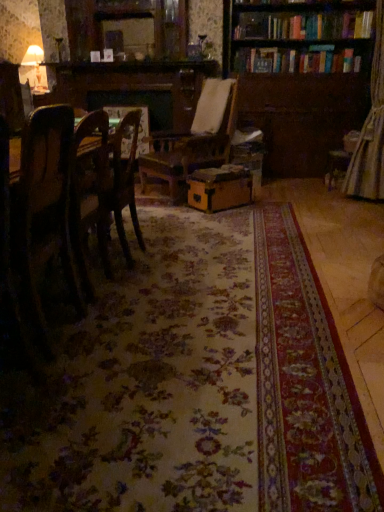
Where is `matte brown cardboard box at center`? matte brown cardboard box at center is located at coordinates (220, 188).

Where is `wooden bookcase at upper right`? wooden bookcase at upper right is located at coordinates (298, 93).

From the picture: Considering their positions, is wooden bookcase at upper right located in front of or behind matte brown cardboard box at center?

wooden bookcase at upper right is positioned farther from the viewer than matte brown cardboard box at center.

What's the angular difference between wooden bookcase at upper right and matte brown cardboard box at center's facing directions?

44.1 degrees separate the facing orientations of wooden bookcase at upper right and matte brown cardboard box at center.

Between wooden bookcase at upper right and matte brown cardboard box at center, which one appears on the left side from the viewer's perspective?

matte brown cardboard box at center.

Could you tell me if wooden bookcase at upper right is facing matte brown cardboard box at center?

Yes, wooden bookcase at upper right is facing matte brown cardboard box at center.

Measure the distance from wooden chair at left to matte brown cardboard box at center.

wooden chair at left is 6.25 feet away from matte brown cardboard box at center.

Who is smaller, wooden chair at left or matte brown cardboard box at center?

Smaller between the two is matte brown cardboard box at center.

From a real-world perspective, is wooden chair at left located higher than matte brown cardboard box at center?

Yes, from a real-world perspective, wooden chair at left is on top of matte brown cardboard box at center.

Considering the sizes of objects wooden chair at left and matte brown cardboard box at center in the image provided, who is taller, wooden chair at left or matte brown cardboard box at center?

wooden chair at left.

Between point (343, 5) and point (74, 281), which one is positioned in front?

Positioned in front is point (74, 281).

From a real-world perspective, relative to wooden chair at left, is wooden bookcase at upper right vertically above or below?

Clearly, from a real-world perspective, wooden bookcase at upper right is above wooden chair at left.

Is wooden bookcase at upper right facing away from wooden chair at left?

No, wooden bookcase at upper right's orientation is not away from wooden chair at left.

Is wooden bookcase at upper right bigger or smaller than wooden chair at left?

wooden bookcase at upper right is bigger than wooden chair at left.

Which of these two, matte brown cardboard box at center or wooden bookcase at upper right, stands shorter?

matte brown cardboard box at center.

This screenshot has height=512, width=384. Find the location of `bookcase above the matte brown cardboard box at center (from a real-world perspective)`. bookcase above the matte brown cardboard box at center (from a real-world perspective) is located at coordinates (298, 93).

From a real-world perspective, is matte brown cardboard box at center over wooden bookcase at upper right?

No, from a real-world perspective, matte brown cardboard box at center is not over wooden bookcase at upper right

Between wooden chair at left and wooden bookcase at upper right, which one has larger size?

Bigger between the two is wooden bookcase at upper right.

Does point (40, 182) appear closer or farther from the camera than point (269, 93)?

Point (40, 182).

In the scene shown: Considering the relative sizes of wooden chair at left and wooden bookcase at upper right in the image provided, is wooden chair at left thinner than wooden bookcase at upper right?

Indeed, wooden chair at left has a lesser width compared to wooden bookcase at upper right.

Does wooden chair at left have a lesser height compared to wooden bookcase at upper right?

Indeed, wooden chair at left has a lesser height compared to wooden bookcase at upper right.

From a real-world perspective, is matte brown cardboard box at center positioned above or below wooden chair at left?

In terms of real-world spatial position, matte brown cardboard box at center is below wooden chair at left.

Which is in front, point (189, 203) or point (46, 215)?

The point (46, 215) is closer to the camera.

From the image's perspective, is matte brown cardboard box at center on wooden chair at left?

Yes, from the image's perspective, matte brown cardboard box at center is above wooden chair at left.

Does matte brown cardboard box at center turn towards wooden chair at left?

No, matte brown cardboard box at center does not turn towards wooden chair at left.

Where is `cardboard box that appears below the wooden bookcase at upper right (from the image's perspective)`? cardboard box that appears below the wooden bookcase at upper right (from the image's perspective) is located at coordinates (220, 188).

Locate an element on the screen. Image resolution: width=384 pixels, height=512 pixels. cardboard box located above the wooden chair at left (from the image's perspective) is located at coordinates (220, 188).

Considering their positions, is wooden chair at left positioned closer to wooden bookcase at upper right than matte brown cardboard box at center?

matte brown cardboard box at center is positioned closer to the anchor wooden bookcase at upper right.

Considering their positions, is wooden chair at left positioned further to matte brown cardboard box at center than wooden bookcase at upper right?

Among the two, wooden chair at left is located further to matte brown cardboard box at center.

When comparing their distances from wooden chair at left, does wooden bookcase at upper right or matte brown cardboard box at center seem closer?

matte brown cardboard box at center lies closer to wooden chair at left than the other object.

Considering their positions, is matte brown cardboard box at center positioned further to wooden bookcase at upper right than wooden chair at left?

wooden chair at left lies further to wooden bookcase at upper right than the other object.

When comparing their distances from wooden chair at left, does matte brown cardboard box at center or wooden bookcase at upper right seem further?

wooden bookcase at upper right lies further to wooden chair at left than the other object.

Based on their spatial positions, is wooden bookcase at upper right or wooden chair at left closer to matte brown cardboard box at center?

wooden bookcase at upper right.

The width and height of the screenshot is (384, 512). What are the coordinates of `cardboard box between wooden chair at left and wooden bookcase at upper right from front to back` in the screenshot? It's located at click(x=220, y=188).